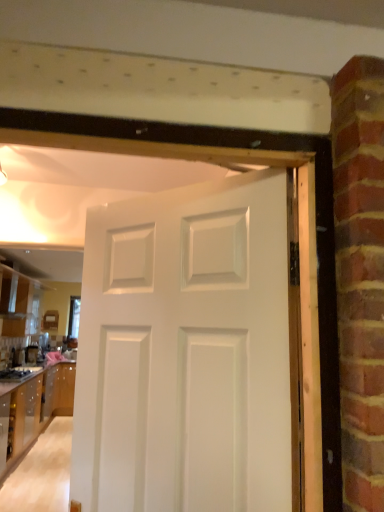
Question: From the image's perspective, would you say white matte door at center is shown under wooden cabinet at lower left, which appears as the second cabinetry when viewed from the top?

Choices:
 (A) no
 (B) yes

Answer: (A)

Question: Does white matte door at center have a greater height compared to wooden cabinet at lower left, acting as the 1th cabinetry starting from the bottom?

Choices:
 (A) no
 (B) yes

Answer: (B)

Question: From a real-world perspective, is white matte door at center located higher than wooden cabinet at lower left, which appears as the second cabinetry when viewed from the top?

Choices:
 (A) yes
 (B) no

Answer: (A)

Question: Does white matte door at center lie behind wooden cabinet at lower left, which appears as the second cabinetry when viewed from the top?

Choices:
 (A) no
 (B) yes

Answer: (A)

Question: From the image's perspective, is white matte door at center located above wooden cabinet at lower left, acting as the 1th cabinetry starting from the bottom?

Choices:
 (A) no
 (B) yes

Answer: (B)

Question: Considering the positions of wooden cabinet at lower left, acting as the 1th cabinetry starting from the bottom, and white matte door at center in the image, is wooden cabinet at lower left, acting as the 1th cabinetry starting from the bottom, taller or shorter than white matte door at center?

Choices:
 (A) short
 (B) tall

Answer: (A)

Question: Is point (62, 414) closer or farther from the camera than point (172, 230)?

Choices:
 (A) closer
 (B) farther

Answer: (B)

Question: From a real-world perspective, is wooden cabinet at lower left, acting as the 1th cabinetry starting from the bottom, positioned above or below white matte door at center?

Choices:
 (A) below
 (B) above

Answer: (A)

Question: Is wooden cabinet at lower left, which appears as the second cabinetry when viewed from the top, situated inside white matte door at center or outside?

Choices:
 (A) outside
 (B) inside

Answer: (A)

Question: Is satin black coffee maker at lower left inside the boundaries of white matte door at center, or outside?

Choices:
 (A) inside
 (B) outside

Answer: (B)

Question: Based on their sizes in the image, would you say satin black coffee maker at lower left is bigger or smaller than white matte door at center?

Choices:
 (A) big
 (B) small

Answer: (B)

Question: Visually, is satin black coffee maker at lower left positioned to the left or to the right of white matte door at center?

Choices:
 (A) left
 (B) right

Answer: (A)

Question: From the image's perspective, relative to white matte door at center, is satin black coffee maker at lower left above or below?

Choices:
 (A) above
 (B) below

Answer: (B)

Question: Is point (132, 355) positioned closer to the camera than point (39, 298)?

Choices:
 (A) farther
 (B) closer

Answer: (B)

Question: Is white matte door at center taller or shorter than glossy wood cabinetry at left, the 2th cabinetry ordered from the bottom?

Choices:
 (A) tall
 (B) short

Answer: (A)